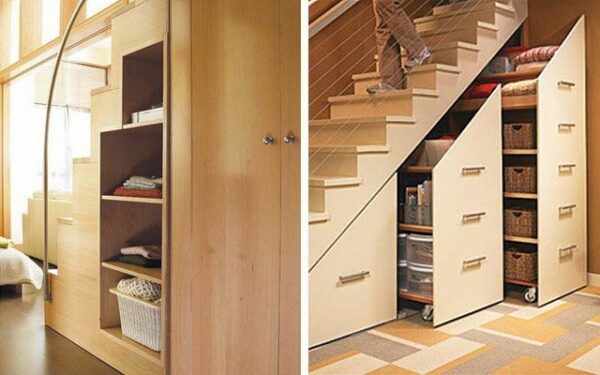
Where is `silver knobs`? The width and height of the screenshot is (600, 375). silver knobs is located at coordinates (266, 138), (291, 138).